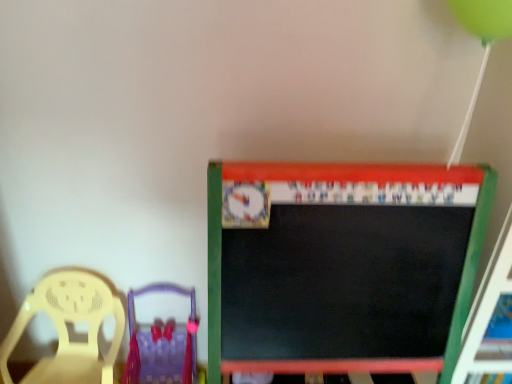
Question: In terms of width, does purple fabric chair at lower left, the 2th chair when ordered from left to right, look wider or thinner when compared to matte yellow chair at left, arranged as the 2th chair when viewed from the right?

Choices:
 (A) wide
 (B) thin

Answer: (A)

Question: From a real-world perspective, is purple fabric chair at lower left, the 2th chair when ordered from left to right, above or below matte yellow chair at left, which is the 1th chair in left-to-right order?

Choices:
 (A) above
 (B) below

Answer: (B)

Question: Considering the positions of point (172, 291) and point (38, 294), is point (172, 291) closer or farther from the camera than point (38, 294)?

Choices:
 (A) closer
 (B) farther

Answer: (B)

Question: From the image's perspective, is matte yellow chair at left, arranged as the 2th chair when viewed from the right, positioned above or below purple fabric chair at lower left, the 2th chair when ordered from left to right?

Choices:
 (A) below
 (B) above

Answer: (B)

Question: Relative to purple fabric chair at lower left, the 2th chair when ordered from left to right, is matte yellow chair at left, which is the 1th chair in left-to-right order, in front or behind?

Choices:
 (A) behind
 (B) front

Answer: (B)

Question: Is matte yellow chair at left, arranged as the 2th chair when viewed from the right, bigger or smaller than purple fabric chair at lower left, the 2th chair when ordered from left to right?

Choices:
 (A) big
 (B) small

Answer: (A)

Question: Is point (74, 291) positioned closer to the camera than point (134, 357)?

Choices:
 (A) closer
 (B) farther

Answer: (A)